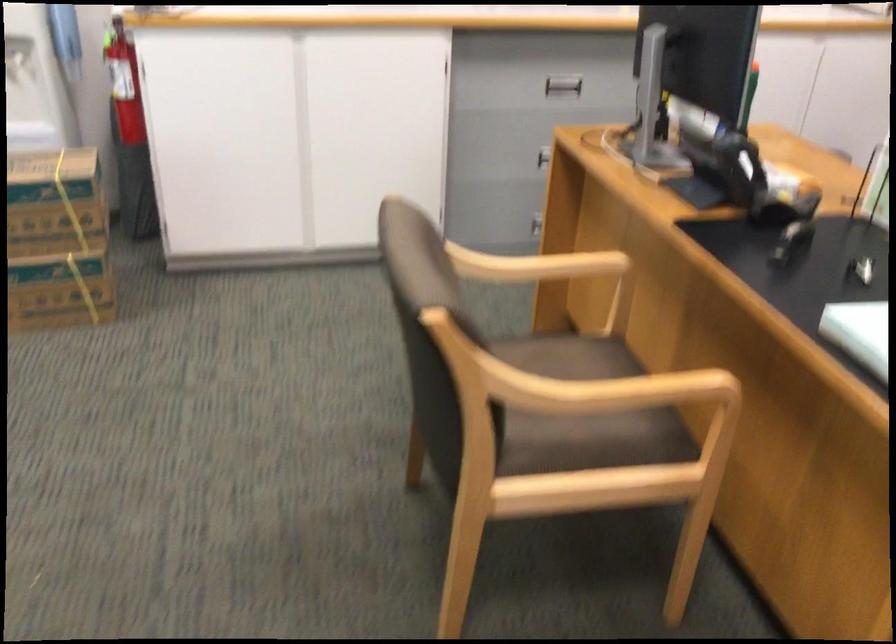
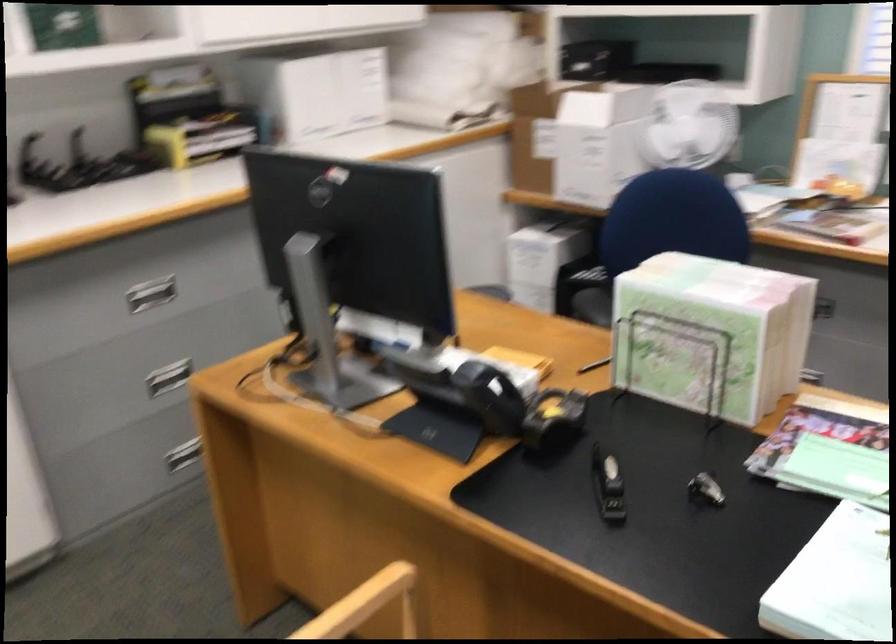
Question: The camera is either moving clockwise (left) or counter-clockwise (right) around the object. The first image is from the beginning of the video and the second image is from the end. Is the camera moving left or right when shooting the video?

Choices:
 (A) Left
 (B) Right

Answer: (A)